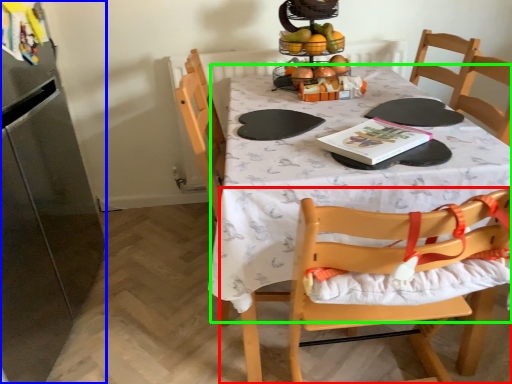
Question: Which object is the closest to the chair (highlighted by a red box)? Choose among these: appliance (highlighted by a blue box) or tablecloth (highlighted by a green box).

Choices:
 (A) appliance
 (B) tablecloth

Answer: (B)